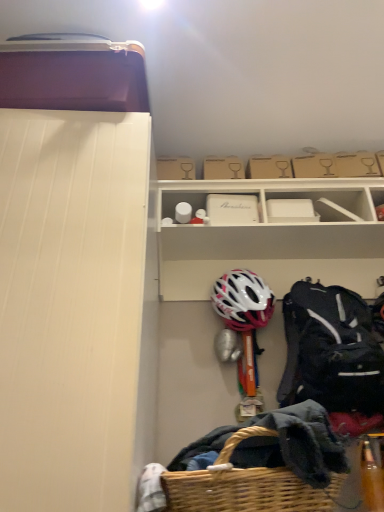
Question: From a real-world perspective, does white matte storage box at upper center, the second storage box positioned from the top, sit lower than brown cardboard box at upper center, which is the 1th storage box in top-to-bottom order?

Choices:
 (A) no
 (B) yes

Answer: (B)

Question: Is white matte storage box at upper center, the second storage box positioned from the top, not inside brown cardboard box at upper center, which is the 1th storage box in top-to-bottom order?

Choices:
 (A) yes
 (B) no

Answer: (A)

Question: Does white matte storage box at upper center, the second storage box positioned from the top, have a greater width compared to brown cardboard box at upper center, which is the 2th storage box in bottom-to-top order?

Choices:
 (A) yes
 (B) no

Answer: (A)

Question: Considering the relative sizes of white matte storage box at upper center, the first storage box when ordered from bottom to top, and brown cardboard box at upper center, which is the 1th storage box in top-to-bottom order, in the image provided, is white matte storage box at upper center, the first storage box when ordered from bottom to top, shorter than brown cardboard box at upper center, which is the 1th storage box in top-to-bottom order,?

Choices:
 (A) yes
 (B) no

Answer: (B)

Question: Does white matte storage box at upper center, the first storage box when ordered from bottom to top, have a smaller size compared to brown cardboard box at upper center, which is the 2th storage box in bottom-to-top order?

Choices:
 (A) yes
 (B) no

Answer: (B)

Question: From the image's perspective, is black synthetic backpack at right above or below white matte helmet at center?

Choices:
 (A) below
 (B) above

Answer: (A)

Question: Does point click(x=329, y=345) appear closer or farther from the camera than point click(x=244, y=312)?

Choices:
 (A) closer
 (B) farther

Answer: (A)

Question: Based on their sizes in the image, would you say black synthetic backpack at right is bigger or smaller than white matte helmet at center?

Choices:
 (A) small
 (B) big

Answer: (B)

Question: Visually, is black synthetic backpack at right positioned to the left or to the right of white matte helmet at center?

Choices:
 (A) right
 (B) left

Answer: (A)

Question: Would you say white matte helmet at center is inside or outside white matte storage box at upper center, the second storage box positioned from the top?

Choices:
 (A) outside
 (B) inside

Answer: (A)

Question: Considering their positions, is white matte helmet at center located in front of or behind white matte storage box at upper center, the first storage box when ordered from bottom to top?

Choices:
 (A) front
 (B) behind

Answer: (A)

Question: From a real-world perspective, is white matte helmet at center positioned above or below white matte storage box at upper center, the second storage box positioned from the top?

Choices:
 (A) below
 (B) above

Answer: (A)

Question: Does point (266, 301) appear closer or farther from the camera than point (221, 214)?

Choices:
 (A) closer
 (B) farther

Answer: (A)

Question: From their relative heights in the image, would you say black synthetic backpack at right is taller or shorter than white matte storage box at upper center, the second storage box positioned from the top?

Choices:
 (A) short
 (B) tall

Answer: (B)

Question: Would you say black synthetic backpack at right is to the left or to the right of white matte storage box at upper center, the second storage box positioned from the top, in the picture?

Choices:
 (A) left
 (B) right

Answer: (B)